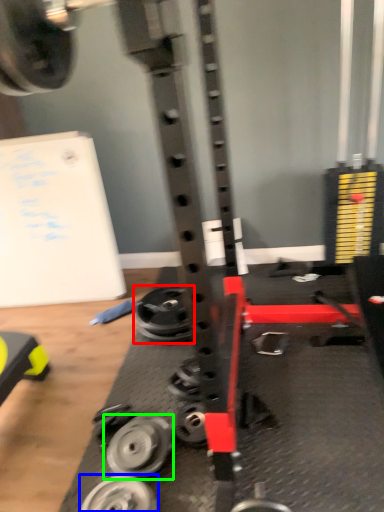
Question: Considering the real-world distances, which object is closest to wheel (highlighted by a red box)? wheel (highlighted by a blue box) or wheel (highlighted by a green box).

Choices:
 (A) wheel
 (B) wheel

Answer: (B)